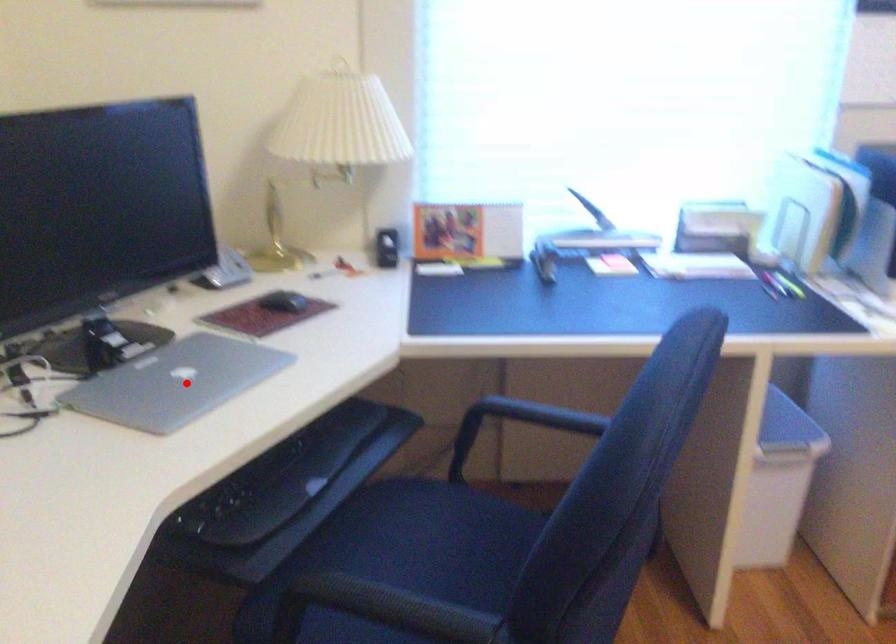
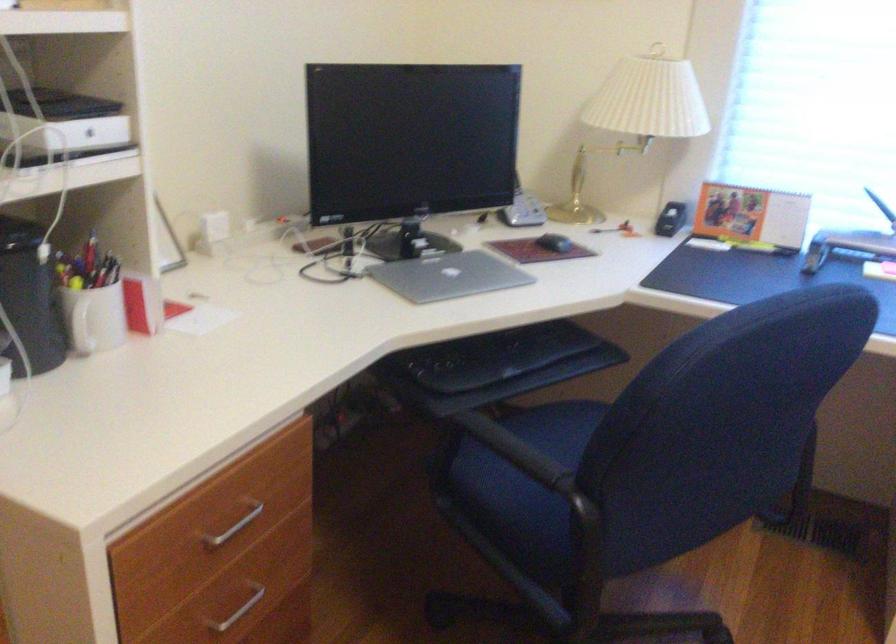
Question: I am providing you with two images of the same scene from different viewpoints. A red point is marked on the first image. Is the red point's position out of view in image 2?

Choices:
 (A) Yes
 (B) No

Answer: (B)